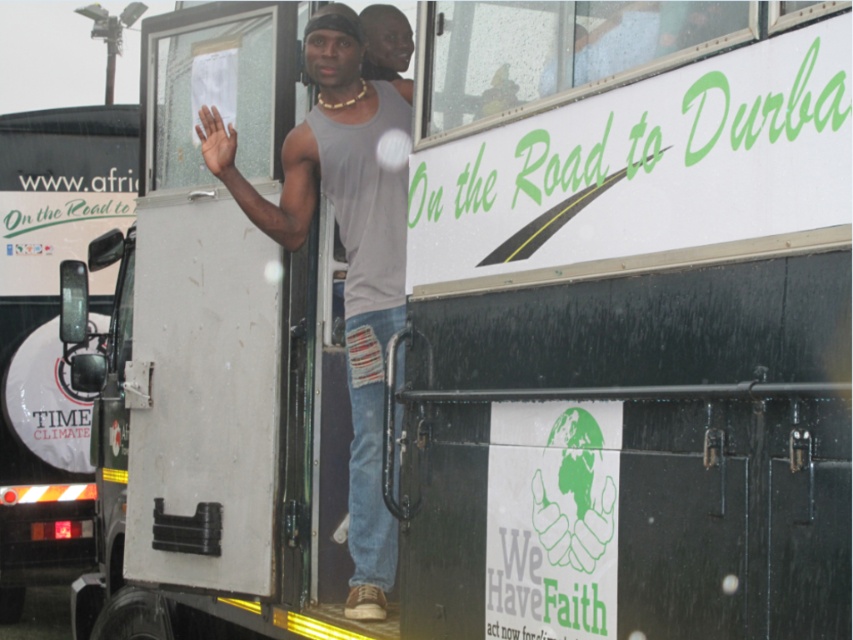
Question: Based on their relative distances, which object is nearer to the matte gray tank top at center?

Choices:
 (A) gray matte tank top at center
 (B) light brown skin at upper center
 (C) white matte truck at left

Answer: (A)

Question: Considering the relative positions of white matte truck at left and light brown skin at upper center in the image provided, where is white matte truck at left located with respect to light brown skin at upper center?

Choices:
 (A) left
 (B) right

Answer: (A)

Question: Which point is farther to the camera?

Choices:
 (A) (374, 28)
 (B) (3, 157)
 (C) (231, 141)
 (D) (281, 240)

Answer: (B)

Question: Which object appears farthest from the camera in this image?

Choices:
 (A) white matte truck at left
 (B) gray matte tank top at center
 (C) light brown skin at upper center
 (D) matte gray tank top at center

Answer: (A)

Question: Observing the image, what is the correct spatial positioning of matte gray tank top at center in reference to light brown skin at upper center?

Choices:
 (A) above
 (B) below

Answer: (A)

Question: Where is gray matte tank top at center located in relation to light brown skin at upper center in the image?

Choices:
 (A) left
 (B) right

Answer: (B)